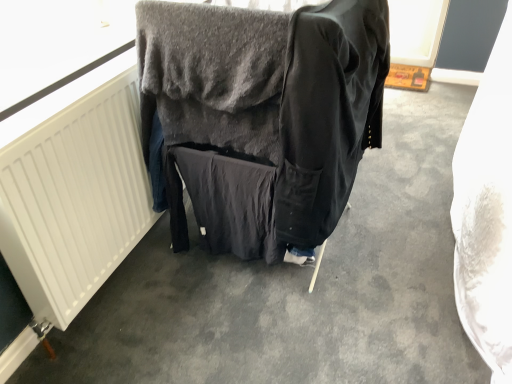
Question: Is black cotton jacket at center not near white matte radiator at left?

Choices:
 (A) no
 (B) yes

Answer: (A)

Question: Considering the relative sizes of black cotton jacket at center and white matte radiator at left in the image provided, is black cotton jacket at center wider than white matte radiator at left?

Choices:
 (A) no
 (B) yes

Answer: (B)

Question: From the image's perspective, is black cotton jacket at center under white matte radiator at left?

Choices:
 (A) yes
 (B) no

Answer: (B)

Question: Does black cotton jacket at center have a greater height compared to white matte radiator at left?

Choices:
 (A) no
 (B) yes

Answer: (B)

Question: Can we say black cotton jacket at center lies outside white matte radiator at left?

Choices:
 (A) no
 (B) yes

Answer: (B)

Question: From the image's perspective, is black cotton jacket at center on white matte radiator at left?

Choices:
 (A) yes
 (B) no

Answer: (A)

Question: Is white matte radiator at left far from dark gray fabric at center?

Choices:
 (A) no
 (B) yes

Answer: (A)

Question: Is the depth of white matte radiator at left less than that of dark gray fabric at center?

Choices:
 (A) yes
 (B) no

Answer: (A)

Question: Considering the relative sizes of white matte radiator at left and dark gray fabric at center in the image provided, is white matte radiator at left wider than dark gray fabric at center?

Choices:
 (A) yes
 (B) no

Answer: (B)

Question: Does white matte radiator at left have a lesser width compared to dark gray fabric at center?

Choices:
 (A) no
 (B) yes

Answer: (B)

Question: Does white matte radiator at left have a smaller size compared to dark gray fabric at center?

Choices:
 (A) no
 (B) yes

Answer: (B)

Question: Does white matte radiator at left have a larger size compared to dark gray fabric at center?

Choices:
 (A) yes
 (B) no

Answer: (B)

Question: Is black cotton jacket at center facing towards dark gray fabric at center?

Choices:
 (A) yes
 (B) no

Answer: (A)